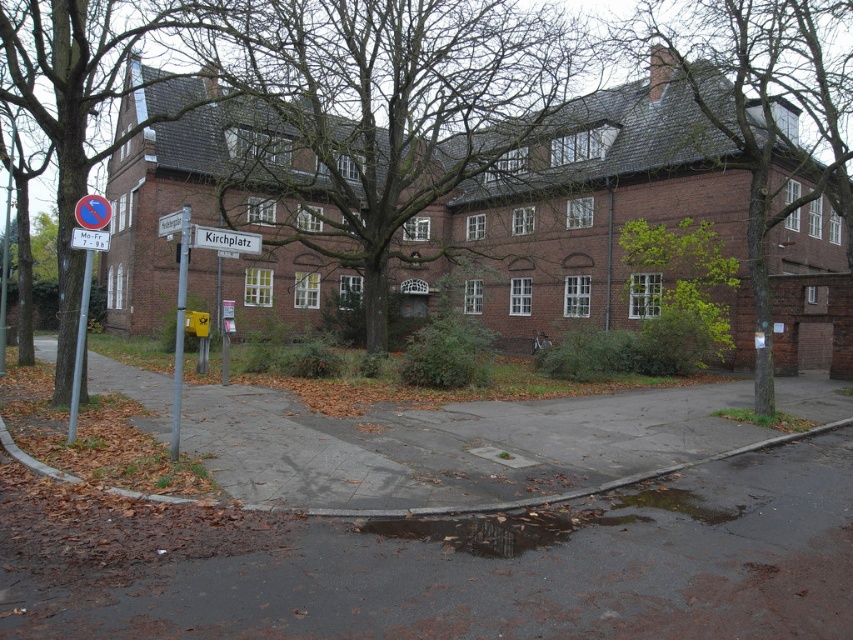
Question: Is bare branches at center to the right of white plastic sign at upper left from the viewer's perspective?

Choices:
 (A) no
 (B) yes

Answer: (A)

Question: Which object is the farthest from the dark reflective wet pavement at lower center?

Choices:
 (A) bare branches at center
 (B) white plastic sign at upper left

Answer: (A)

Question: Does green leafy tree at left have a smaller size compared to white plastic sign at upper left?

Choices:
 (A) yes
 (B) no

Answer: (B)

Question: Which object is positioned closest to the bare branches at center?

Choices:
 (A) white plastic sign at upper center
 (B) white plastic street sign at center
 (C) green leafy tree at center

Answer: (A)

Question: Is green leafy tree at upper right smaller than green leafy tree at center?

Choices:
 (A) no
 (B) yes

Answer: (A)

Question: Which point is farther from the camera taking this photo?

Choices:
 (A) (561, 520)
 (B) (61, 284)
 (C) (178, 224)

Answer: (B)